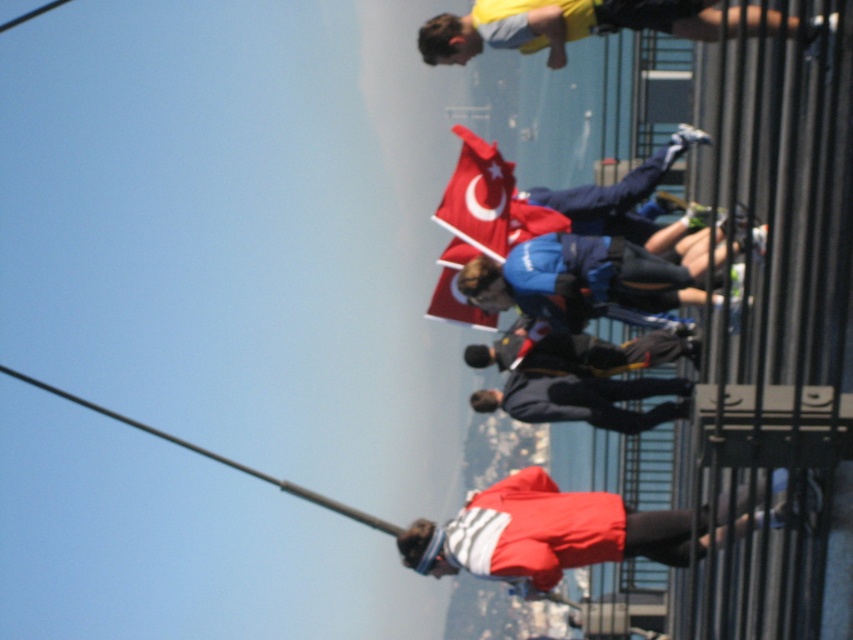
Question: Which of the following is the farthest from the observer?

Choices:
 (A) (677, 4)
 (B) (531, 580)

Answer: (B)

Question: Does yellow fabric shirt at upper center appear under dark blue fabric jacket at center?

Choices:
 (A) yes
 (B) no

Answer: (B)

Question: Among these points, which one is farthest from the camera?

Choices:
 (A) (651, 298)
 (B) (471, 134)
 (C) (456, 538)
 (D) (691, 356)

Answer: (B)

Question: Which point is closer to the camera?

Choices:
 (A) red fabric jacket at center
 (B) dark blue fabric jacket at center
 (C) yellow fabric shirt at upper center
 (D) red fabric flag at center

Answer: (A)

Question: Can you confirm if yellow fabric shirt at upper center is bigger than dark blue fabric jacket at center?

Choices:
 (A) yes
 (B) no

Answer: (A)

Question: Can you confirm if blue fabric jacket at center is positioned above red fabric flag at center?

Choices:
 (A) no
 (B) yes

Answer: (A)